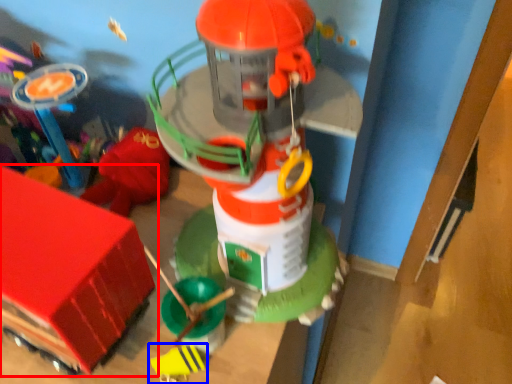
Question: Which object appears farthest to the camera in this image, toy (highlighted by a red box) or toy (highlighted by a blue box)?

Choices:
 (A) toy
 (B) toy

Answer: (B)